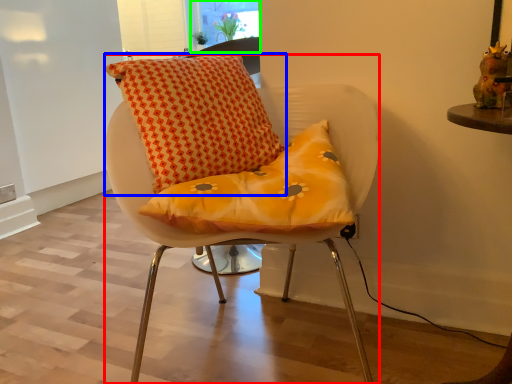
Question: Which object is the farthest from chair (highlighted by a red box)? Choose among these: pillow (highlighted by a blue box) or window screen (highlighted by a green box).

Choices:
 (A) pillow
 (B) window screen

Answer: (B)